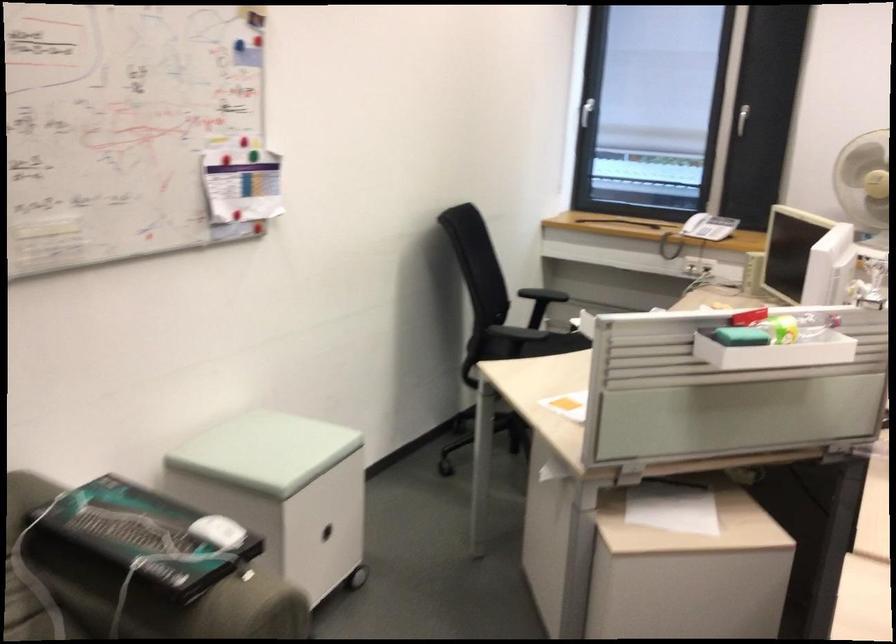
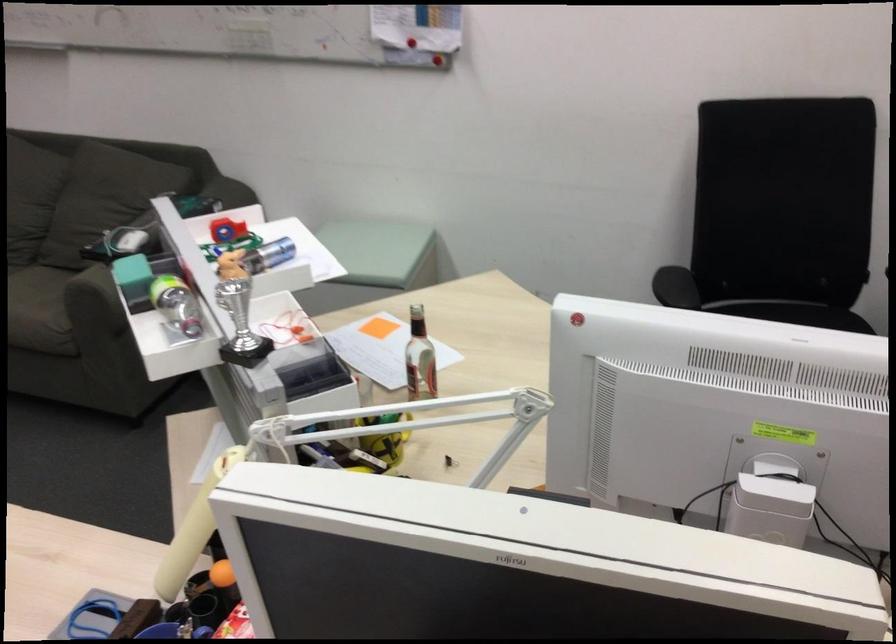
Locate, in the second image, the point that corresponds to (x=218, y=230) in the first image.

(409, 59)